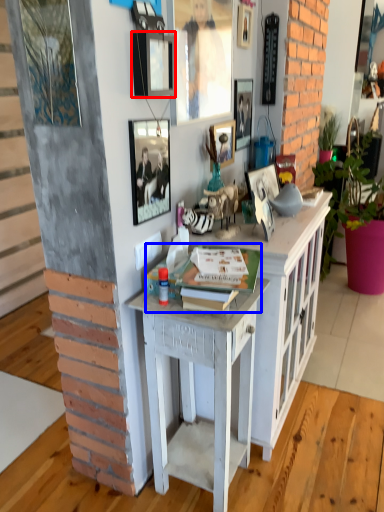
Question: Which object is further to the camera taking this photo, picture frame (highlighted by a red box) or book (highlighted by a blue box)?

Choices:
 (A) picture frame
 (B) book

Answer: (B)